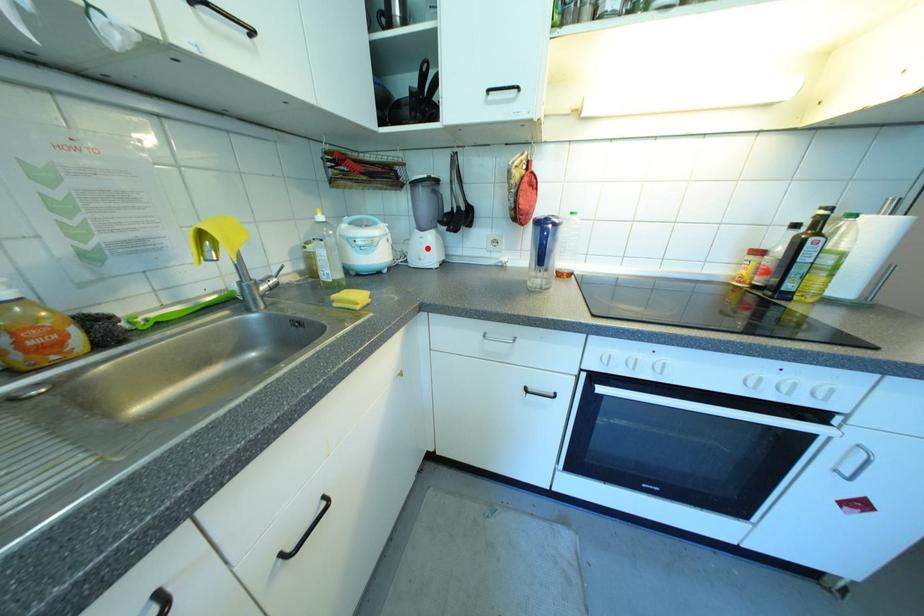
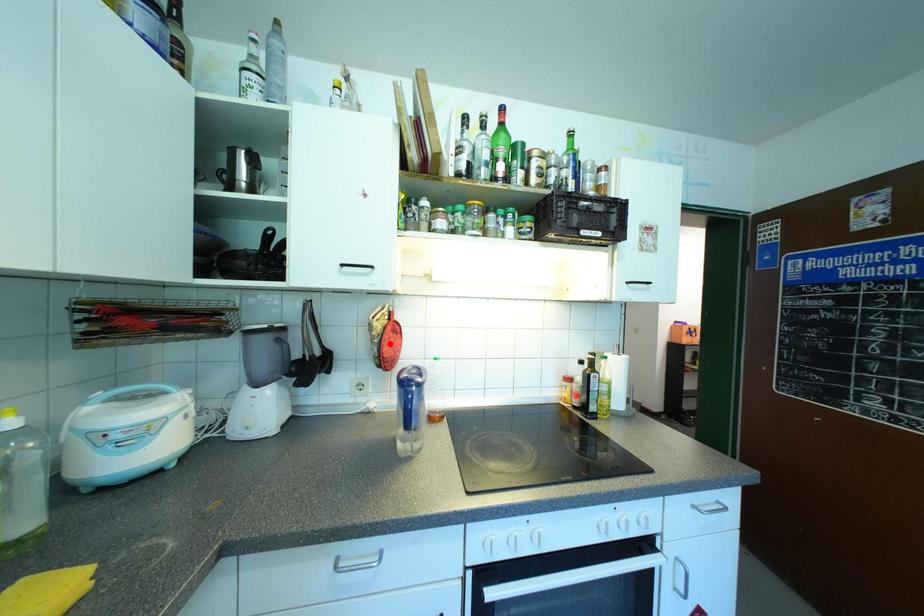
I am providing you with two images of the same scene from different viewpoints. A red point is marked on the first image and another point is marked on the second image. Does the point marked in image1 correspond to the same location as the one in image2?

No